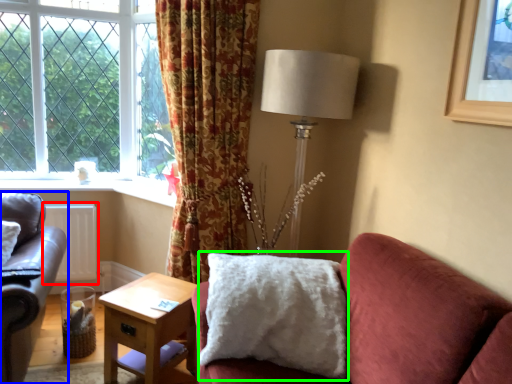
Question: Which object is the closest to the radiator (highlighted by a red box)? Choose among these: studio couch (highlighted by a blue box) or pillow (highlighted by a green box).

Choices:
 (A) studio couch
 (B) pillow

Answer: (A)